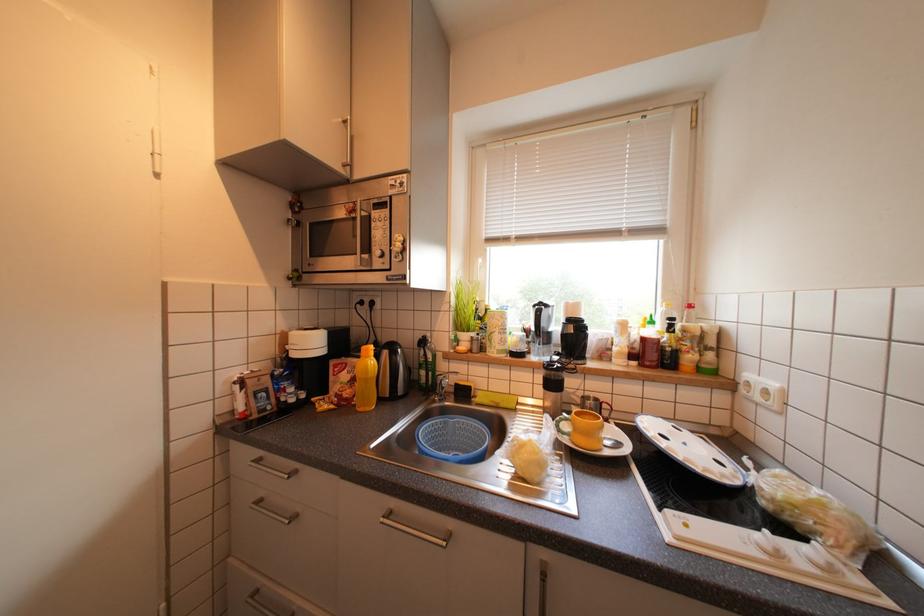
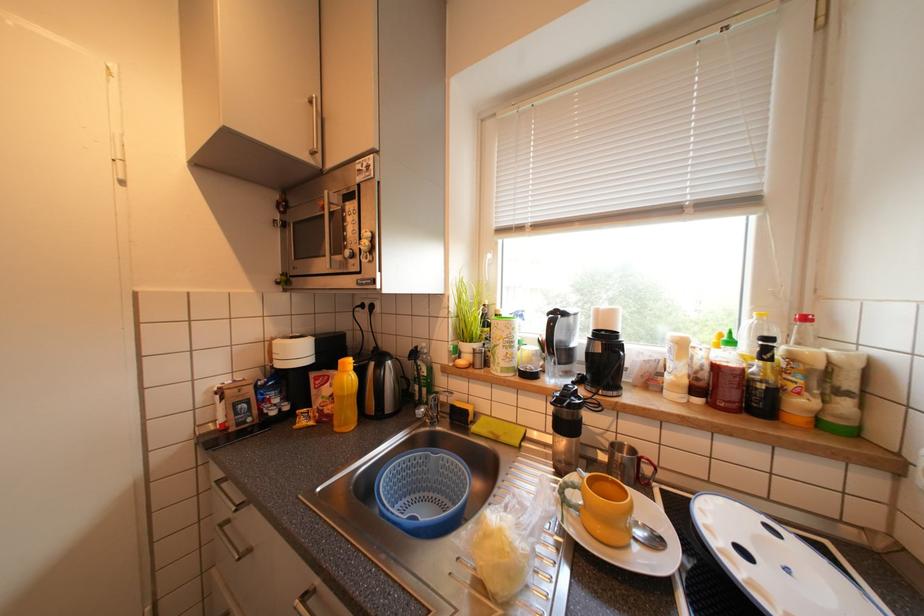
In the scene shown: What movement of the cameraman would produce the second image?

The cameraman walked toward right, forward.